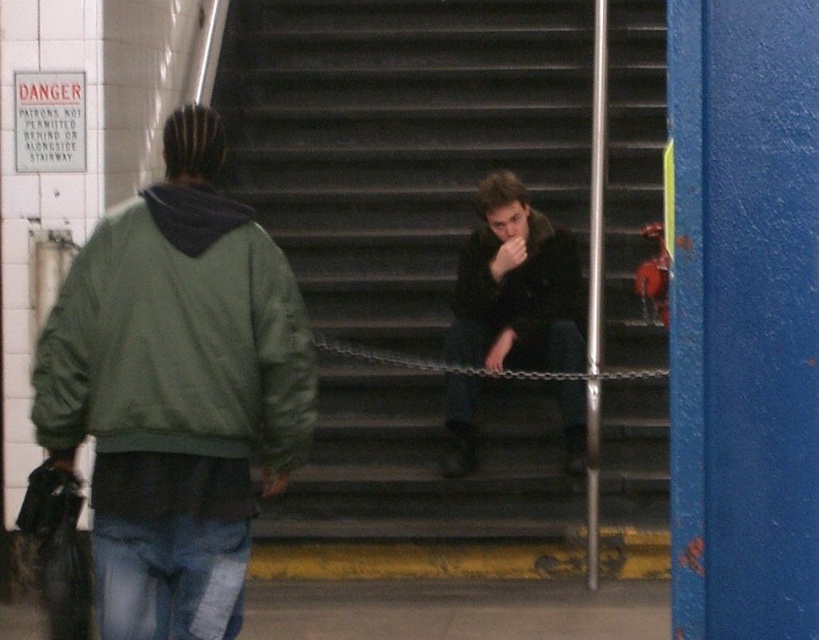
Is green matte jacket at left further to camera compared to black matte jacket at center?

No, green matte jacket at left is in front of black matte jacket at center.

Between point (155, 396) and point (569, 326), which one is positioned behind?

Positioned behind is point (569, 326).

Identify the location of green matte jacket at left. The image size is (819, 640). (179, 337).

Which is in front, point (582, 310) or point (609, 374)?

Positioned in front is point (609, 374).

At what (x,y) coordinates should I click in order to perform the action: click on dark brown leather jacket at center. Please return your answer as a coordinate pair (x, y). The image size is (819, 640). Looking at the image, I should click on 521,282.

Which of these two, green matte jacket at left or metallic chain at center, stands shorter?

metallic chain at center is shorter.

Can you confirm if green matte jacket at left is positioned below metallic chain at center?

No, green matte jacket at left is not below metallic chain at center.

Does point (53, 436) come in front of point (482, 372)?

Yes.

Locate an element on the screen. This screenshot has height=640, width=819. green matte jacket at left is located at coordinates (179, 337).